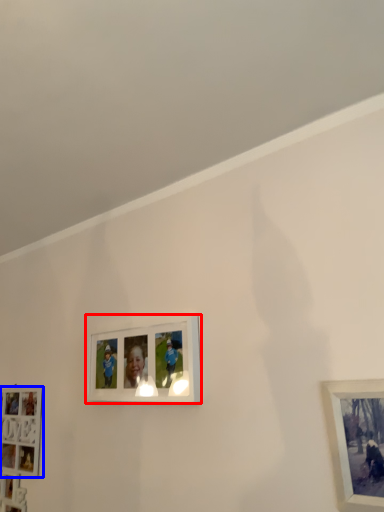
Question: Which object appears closest to the camera in this image, picture frame (highlighted by a red box) or picture frame (highlighted by a blue box)?

Choices:
 (A) picture frame
 (B) picture frame

Answer: (A)